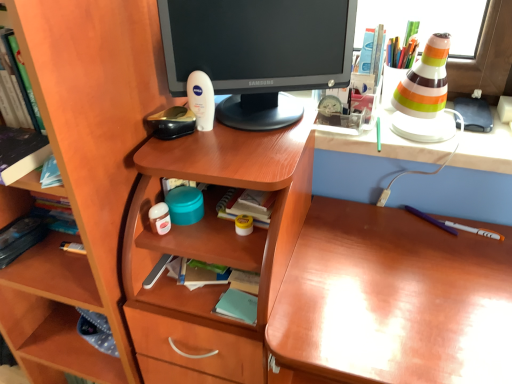
Question: Is matte black monitor at center inside the boundaries of hardcover book at left, the first book in the top-to-bottom sequence, or outside?

Choices:
 (A) inside
 (B) outside

Answer: (B)

Question: Does point (269, 48) appear closer or farther from the camera than point (29, 157)?

Choices:
 (A) closer
 (B) farther

Answer: (B)

Question: Which object is the closest to the hardcover book at left, which is the third book from back to front?

Choices:
 (A) white glossy cone at upper right
 (B) matte black monitor at center
 (C) wooden shelf at left
 (D) wooden at left
 (E) light blue paper at center, positioned as the second book in front-to-back order

Answer: (C)

Question: Which object is the closest to the glossy wood desk at center?

Choices:
 (A) matte black monitor at center
 (B) wooden at left
 (C) white glossy cone at upper right
 (D) hardcover book at left, the first book in the top-to-bottom sequence
 (E) light blue paper at center, the first book positioned from the right

Answer: (B)